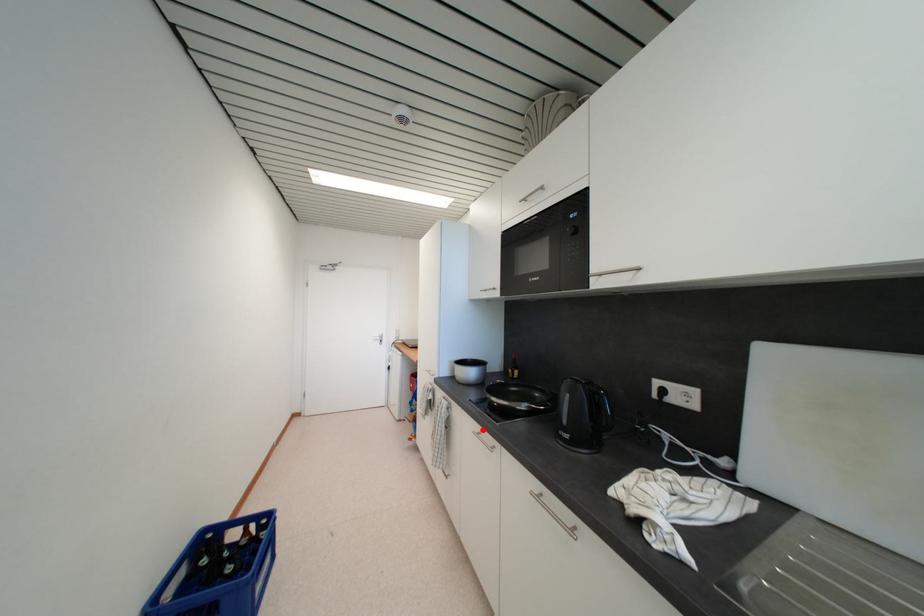
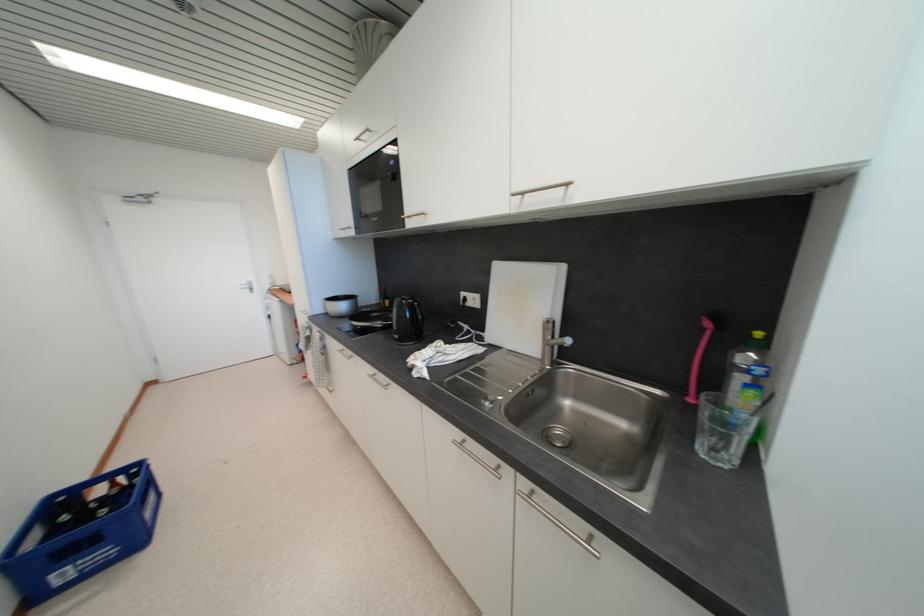
Where in the second image is the point corresponding to the highlighted location from the first image?

(346, 349)